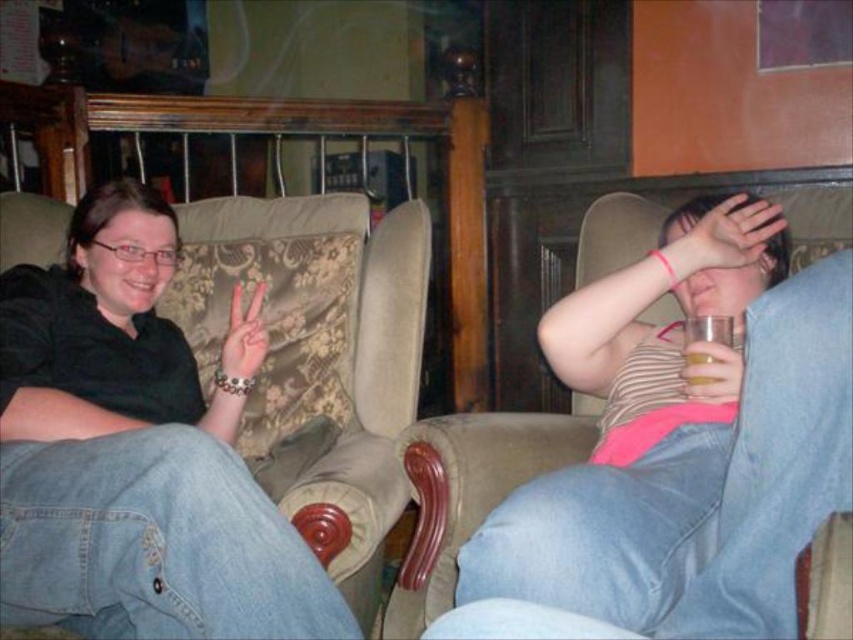
Question: Which point is farther to the camera?

Choices:
 (A) pink matte hand at center
 (B) translucent glass at right
 (C) black matte shirt at left
 (D) matte pink tank top at center

Answer: (A)

Question: Can you confirm if black matte shirt at left is positioned to the left of translucent glass at right?

Choices:
 (A) yes
 (B) no

Answer: (A)

Question: Which object is positioned closest to the matte pink tank top at center?

Choices:
 (A) black matte shirt at left
 (B) translucent glass at right
 (C) pink matte hand at center

Answer: (B)

Question: Does black matte shirt at left appear on the right side of pink matte hand at center?

Choices:
 (A) no
 (B) yes

Answer: (A)

Question: Is black matte shirt at left in front of matte pink tank top at center?

Choices:
 (A) yes
 (B) no

Answer: (B)

Question: Which object appears closest to the camera in this image?

Choices:
 (A) translucent glass at right
 (B) matte pink tank top at center
 (C) black matte shirt at left
 (D) pink matte hand at center

Answer: (B)